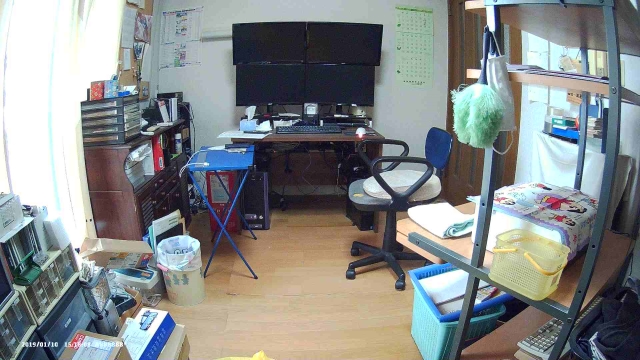
The image size is (640, 360). Find the location of `monitor`. monitor is located at coordinates (272, 41), (361, 32), (352, 90), (285, 75).